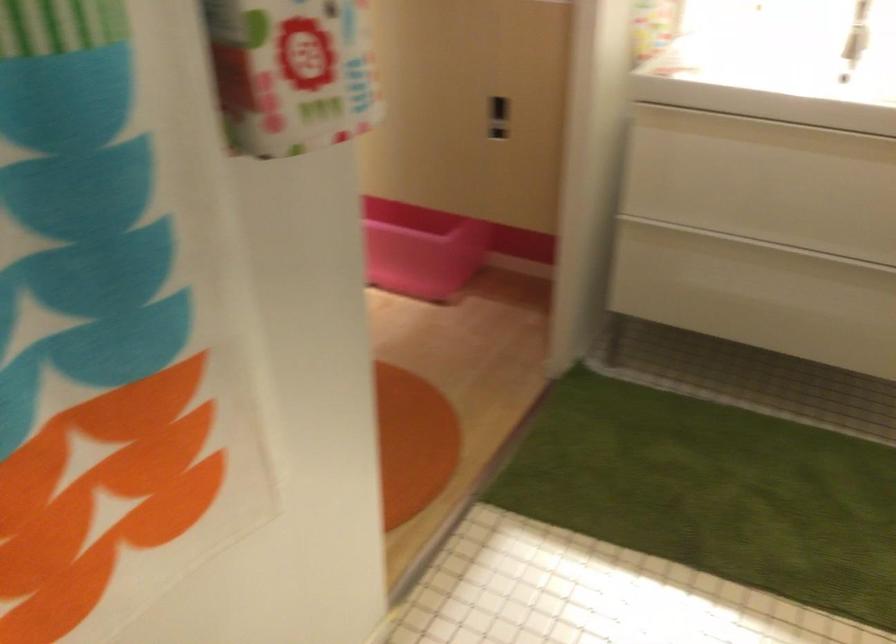
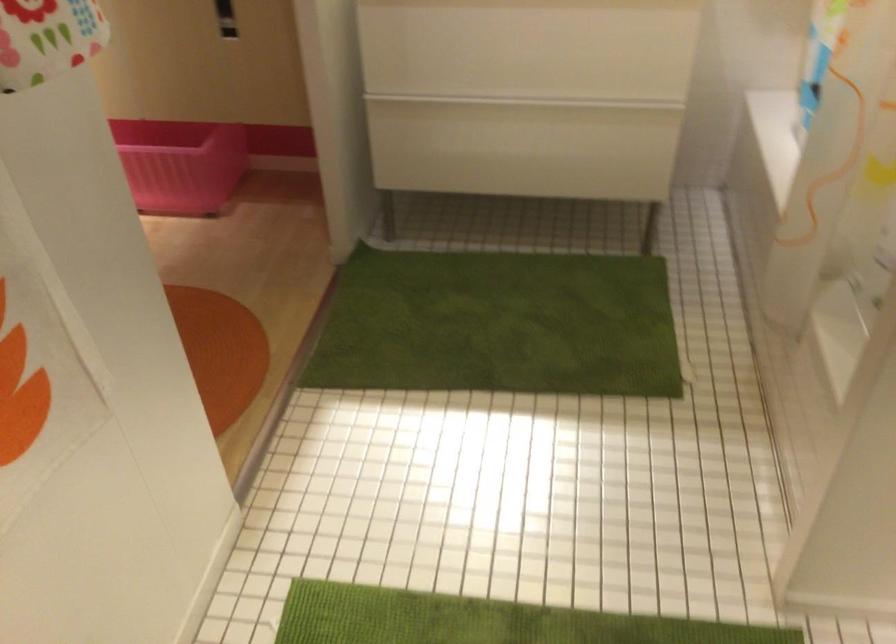
Question: Which direction would the cameraman need to move to produce the second image? Reply with the corresponding letter.

Choices:
 (A) Left
 (B) Right
 (C) Forward
 (D) Backward

Answer: (D)